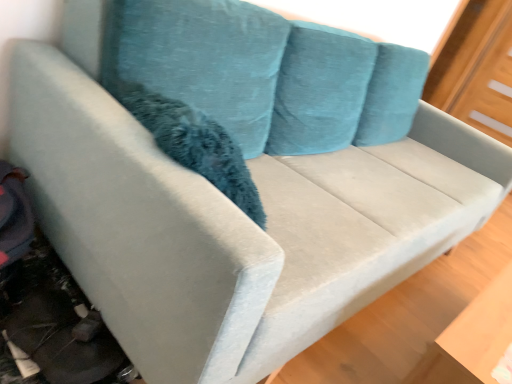
Identify the location of light wood table at lower right. Image resolution: width=512 pixels, height=384 pixels. (482, 329).

The width and height of the screenshot is (512, 384). What do you see at coordinates (482, 329) in the screenshot? I see `light wood table at lower right` at bounding box center [482, 329].

Locate an element on the screen. light wood table at lower right is located at coordinates (482, 329).